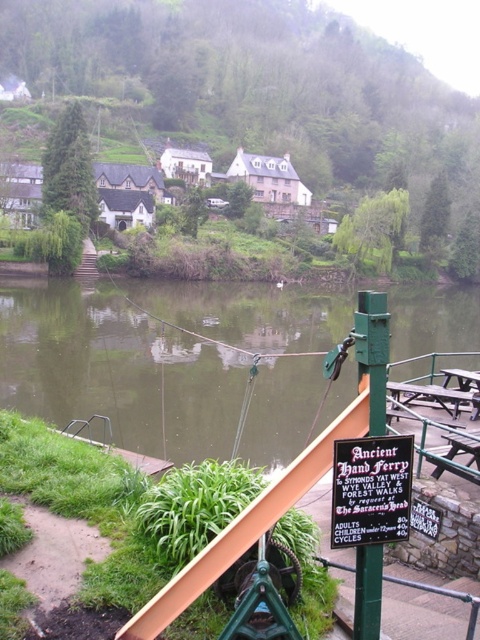
Question: Which is farther from the green smooth water at center?

Choices:
 (A) green painted metal pole at lower right
 (B) black plastic sign at center-right

Answer: (A)

Question: Considering the relative positions of green painted metal pole at lower right and wooden picnic table at center in the image provided, where is green painted metal pole at lower right located with respect to wooden picnic table at center?

Choices:
 (A) below
 (B) above

Answer: (B)

Question: Which point is closer to the camera?

Choices:
 (A) (395, 515)
 (B) (365, 566)
 (C) (457, 385)

Answer: (B)

Question: Which object is positioned closest to the green painted metal pole at lower right?

Choices:
 (A) black plastic sign at center-right
 (B) green smooth water at center

Answer: (A)

Question: Does black plastic sign at center-right have a lesser width compared to green painted metal pole at lower right?

Choices:
 (A) no
 (B) yes

Answer: (A)

Question: Can you confirm if green smooth water at center is wider than black plastic sign at center-right?

Choices:
 (A) no
 (B) yes

Answer: (B)